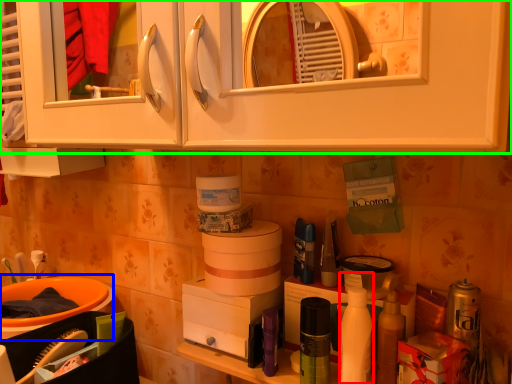
Question: Estimate the real-world distances between objects in this image. Which object is closer to cleaning product (highlighted by a red box), sink (highlighted by a blue box) or cabinetry (highlighted by a green box)?

Choices:
 (A) sink
 (B) cabinetry

Answer: (B)